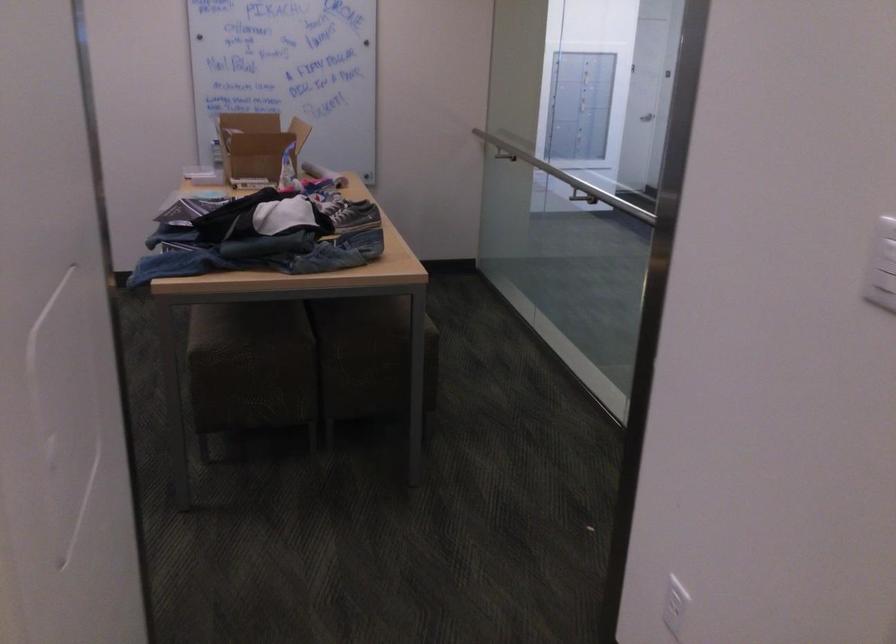
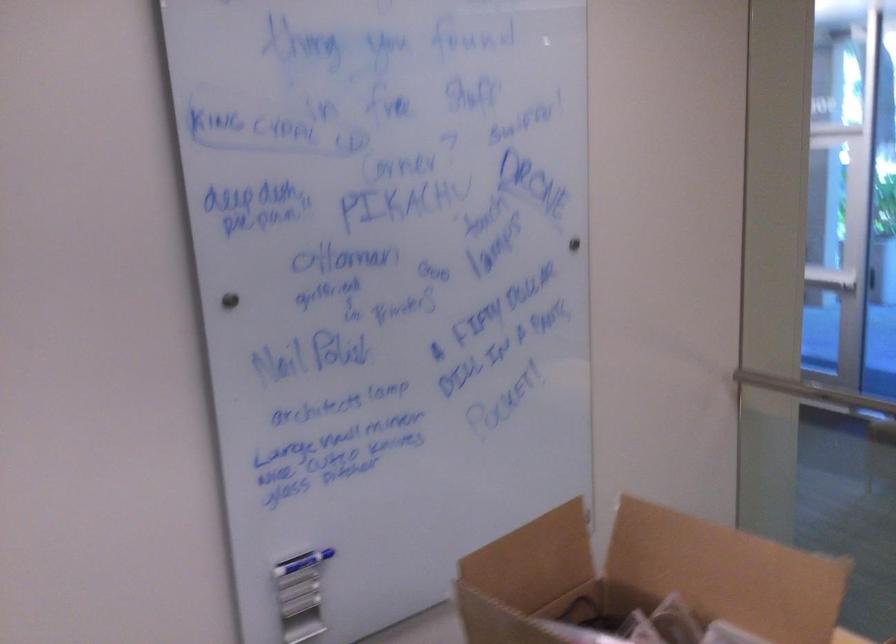
Locate, in the second image, the point that corresponds to (200,111) in the first image.

(302, 562)